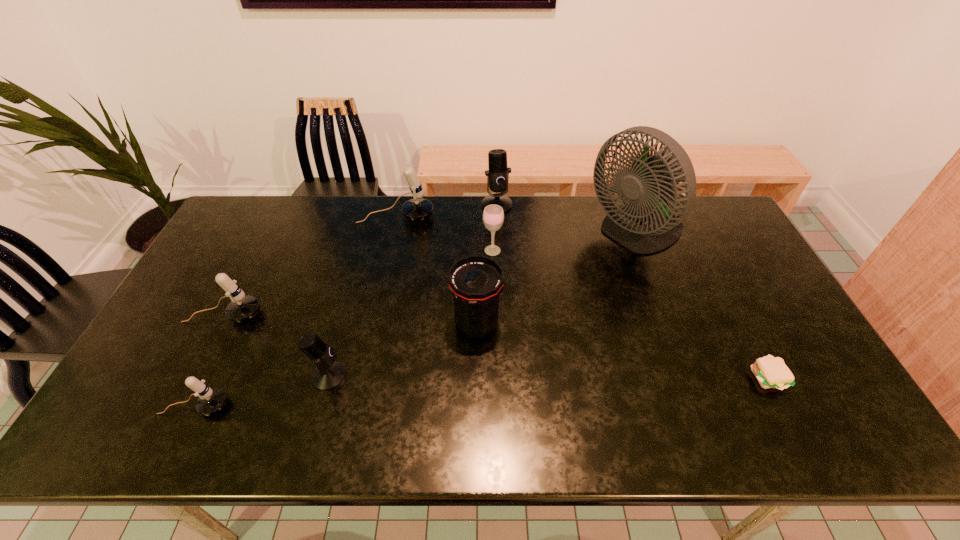
Identify the location of white microphone that is the closest to the biggest white microphone. This screenshot has width=960, height=540. (241, 308).

The width and height of the screenshot is (960, 540). I want to click on vacant space that satisfies the following two spatial constraints: 1. in front of the tallest object to direct airflow; 2. on the front side of the wineglass, so click(642, 251).

I want to click on vacant space that satisfies the following two spatial constraints: 1. on the front side of the wineglass; 2. on the left side of the rightmost white microphone, so click(389, 251).